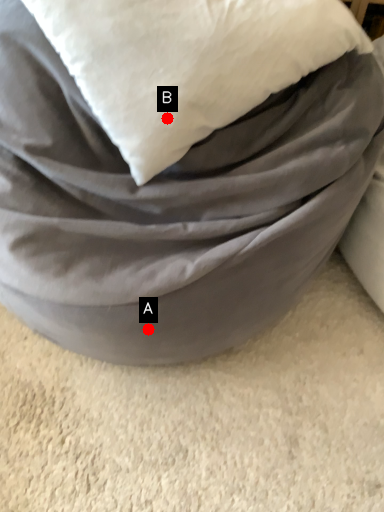
Question: Two points are circled on the image, labeled by A and B beside each circle. Among these points, which one is nearest to the camera?

Choices:
 (A) A is closer
 (B) B is closer

Answer: (B)